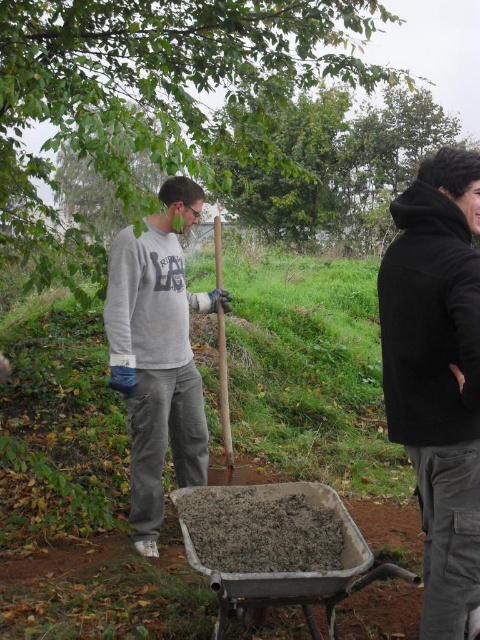
You are standing at the center of the grassy area and want to move towards the green leafy tree at upper left. Which direction should you head?

The green leafy tree at upper left is located at point (156, 100), so you should head towards the upper left direction from your current position at the center of the grassy area.